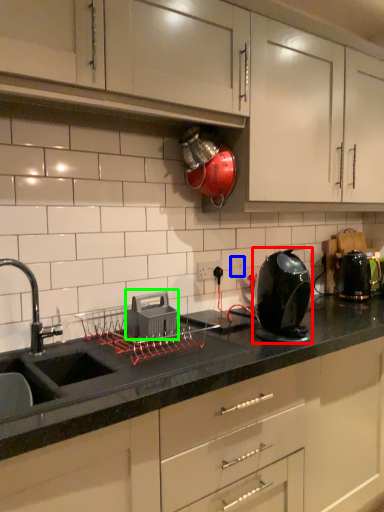
Question: Based on their relative distances, which object is farther from home appliance (highlighted by a red box)? Choose from electric outlet (highlighted by a blue box) and appliance (highlighted by a green box).

Choices:
 (A) electric outlet
 (B) appliance

Answer: (A)